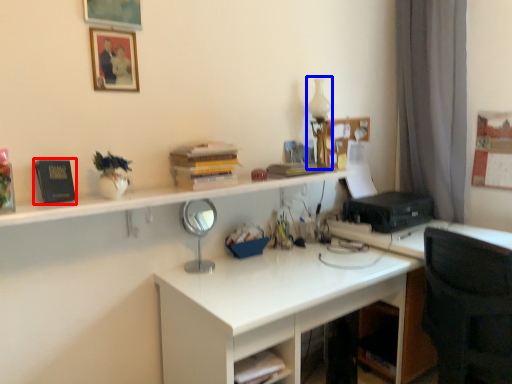
Question: Which object appears closest to the camera in this image, book (highlighted by a red box) or table lamp (highlighted by a blue box)?

Choices:
 (A) book
 (B) table lamp

Answer: (A)